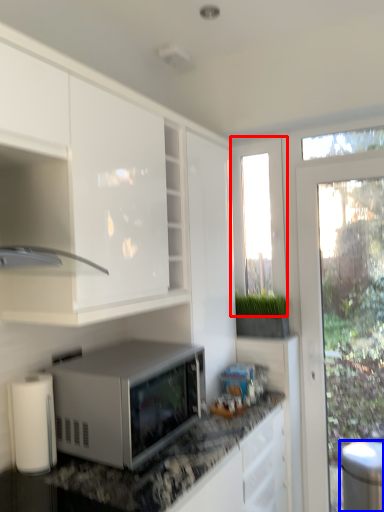
Question: Which point is further to the camera, window screen (highlighted by a red box) or appliance (highlighted by a blue box)?

Choices:
 (A) window screen
 (B) appliance

Answer: (A)